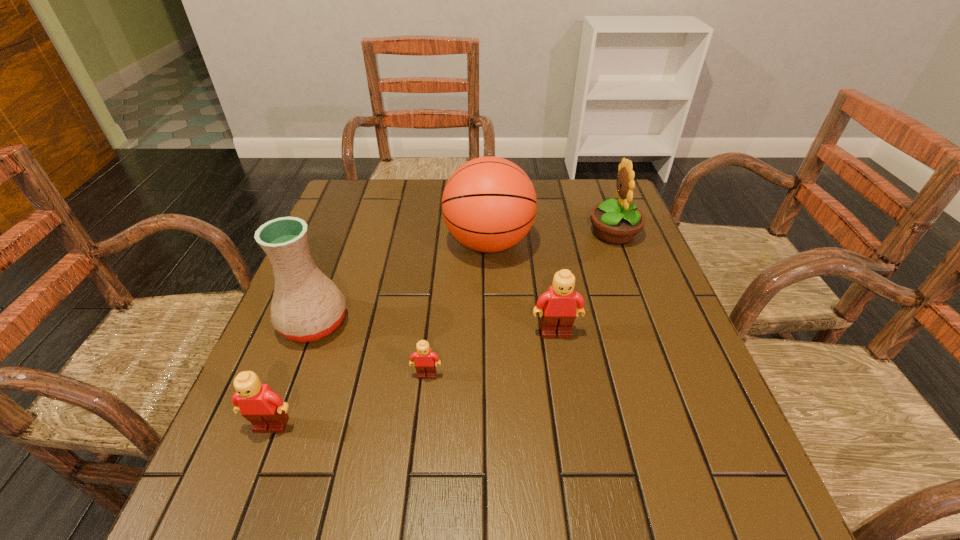
The height and width of the screenshot is (540, 960). Identify the location of vacant region located 0.050m on the left of the basketball. (426, 243).

At what (x,y) coordinates should I click in order to perform the action: click on vacant area situated on the face of the sunflower. Please return your answer as a coordinate pair (x, y). The width and height of the screenshot is (960, 540). Looking at the image, I should click on (531, 233).

Find the location of a particular element. The image size is (960, 540). free space located 0.180m on the face of the sunflower is located at coordinates (523, 233).

Where is `free location located 0.160m on the face of the sunflower`? free location located 0.160m on the face of the sunflower is located at coordinates (531, 233).

I want to click on vacant space located 0.100m on the right of the pottery, so click(394, 323).

This screenshot has height=540, width=960. In order to click on basketball that is at the far edge in this screenshot , I will do `click(489, 204)`.

The image size is (960, 540). In order to click on sunflower that is at the far edge in this screenshot , I will do point(615,222).

Locate an element on the screen. object that is at the near edge is located at coordinates (265, 409).

Image resolution: width=960 pixels, height=540 pixels. Find the location of `Lego present at the left edge`. Lego present at the left edge is located at coordinates (265, 409).

This screenshot has height=540, width=960. Find the location of `pottery situated at the left edge`. pottery situated at the left edge is located at coordinates (306, 305).